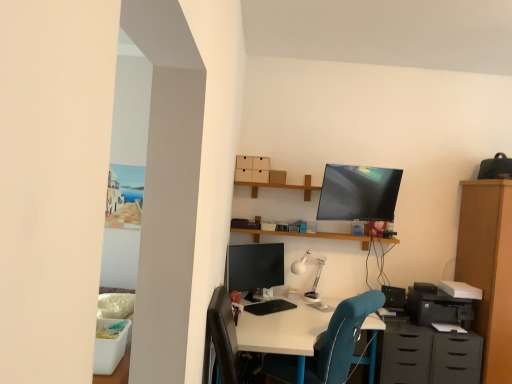
Identify the location of vacant region in front of white matte desk lamp at center. (310, 312).